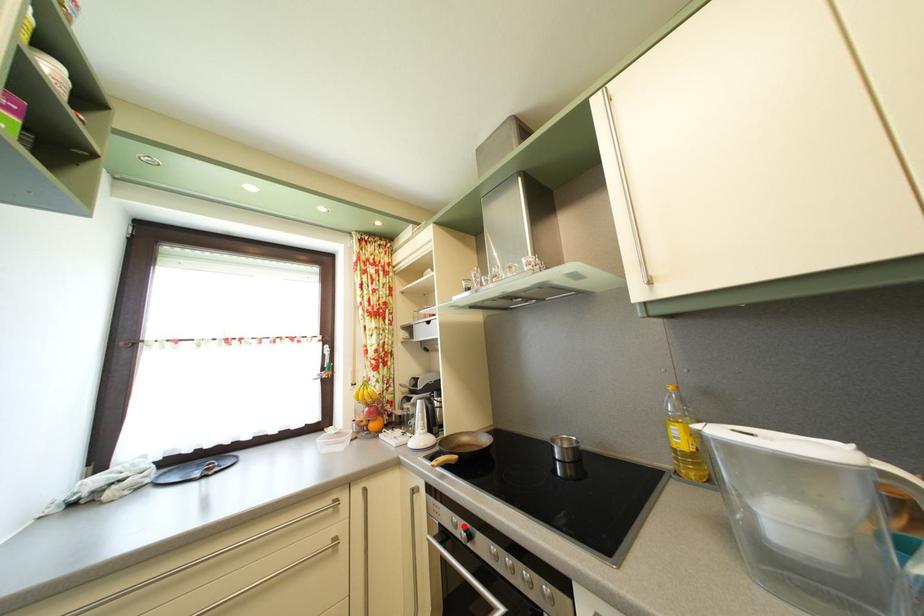
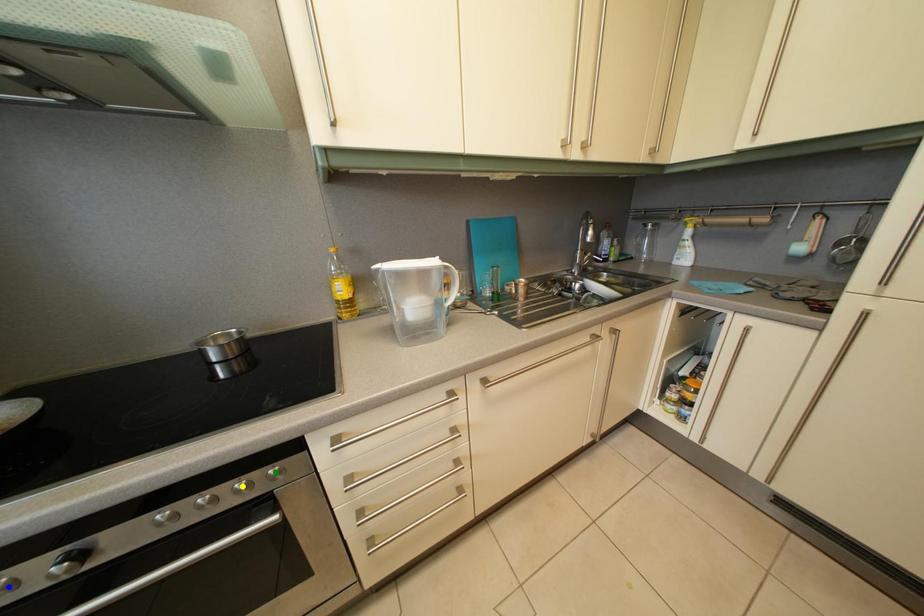
Question: I am providing you with two images of the same scene from different viewpoints. A red point is marked on the first image. You are given multiple points on the second image. In image 2, which mark is for the same physical point as the one in image 1?

Choices:
 (A) blue point
 (B) green point
 (C) yellow point

Answer: (A)